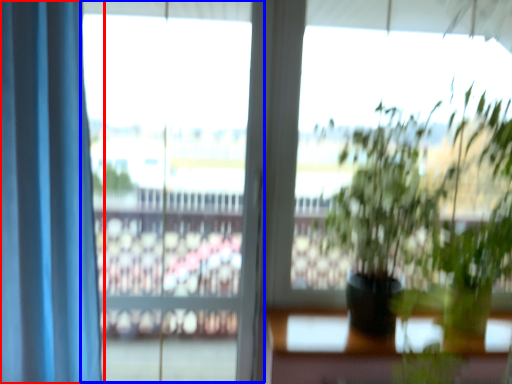
Question: Among these objects, which one is nearest to the camera, curtain (highlighted by a red box) or window frame (highlighted by a blue box)?

Choices:
 (A) curtain
 (B) window frame

Answer: (A)